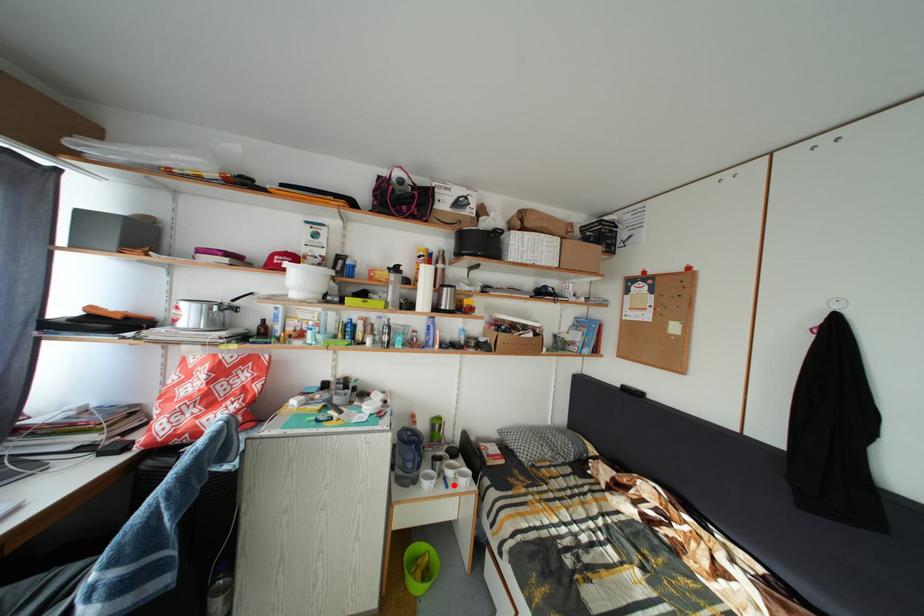
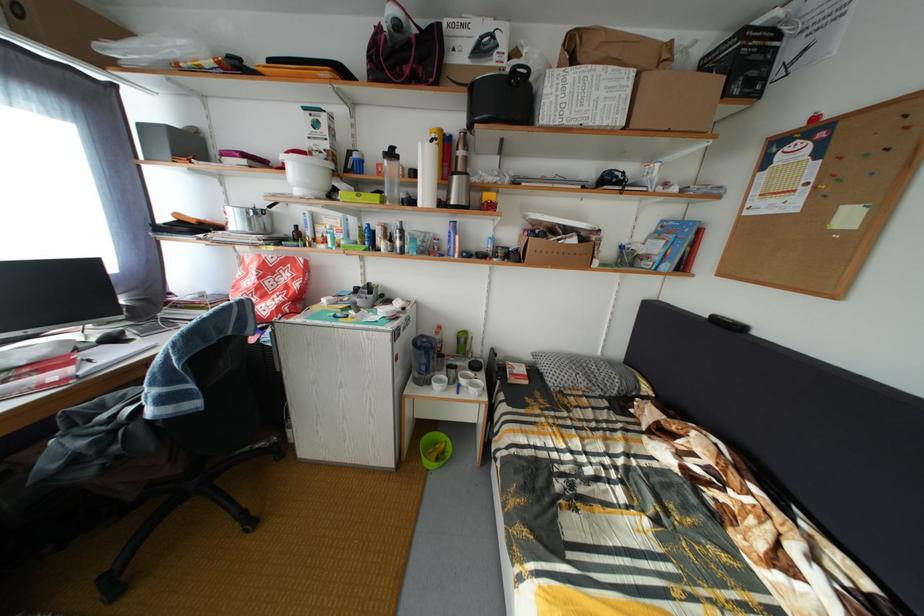
In the second image, find the point that corresponds to the highlighted location in the first image.

(468, 392)